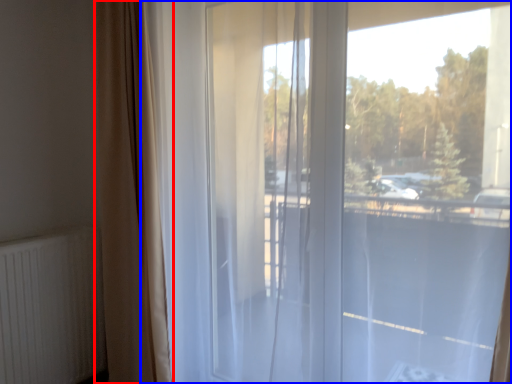
Question: Which object appears closest to the camera in this image, curtain (highlighted by a red box) or window (highlighted by a blue box)?

Choices:
 (A) curtain
 (B) window

Answer: (B)